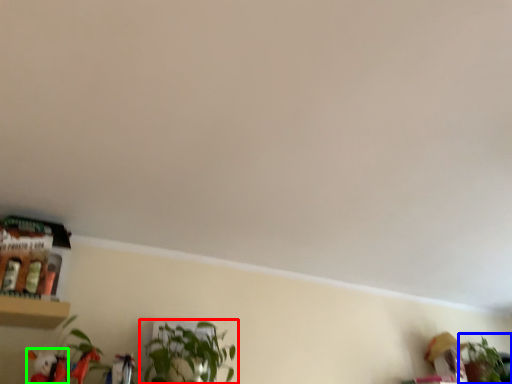
Question: Considering the real-world distances, which object is farthest from houseplant (highlighted by a red box)? houseplant (highlighted by a blue box) or toy (highlighted by a green box)?

Choices:
 (A) houseplant
 (B) toy

Answer: (A)